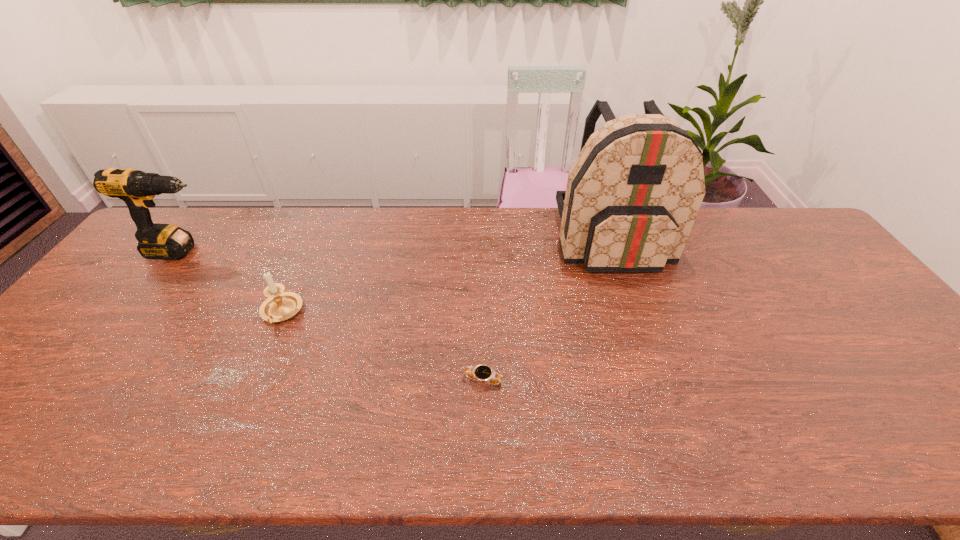
Locate an element on the screen. The height and width of the screenshot is (540, 960). the tallest object is located at coordinates (633, 193).

Locate an element on the screen. This screenshot has height=540, width=960. backpack is located at coordinates (633, 193).

Where is `the second tallest object`? This screenshot has height=540, width=960. the second tallest object is located at coordinates pos(136,188).

The image size is (960, 540). Find the location of `the leftmost object`. the leftmost object is located at coordinates (136, 188).

Locate an element on the screen. This screenshot has width=960, height=540. the second shortest object is located at coordinates (279, 306).

At what (x,y) coordinates should I click in order to perform the action: click on the third object from right to left. Please return your answer as a coordinate pair (x, y). Looking at the image, I should click on (279, 306).

This screenshot has height=540, width=960. I want to click on the third object from left to right, so click(x=484, y=373).

Identify the location of the shortest object. (484, 373).

The width and height of the screenshot is (960, 540). Find the location of `free location located on the front face of the rightmost object`. free location located on the front face of the rightmost object is located at coordinates (636, 307).

Where is `vacant space located 0.110m at the tip of the second tallest object`? The height and width of the screenshot is (540, 960). vacant space located 0.110m at the tip of the second tallest object is located at coordinates (256, 252).